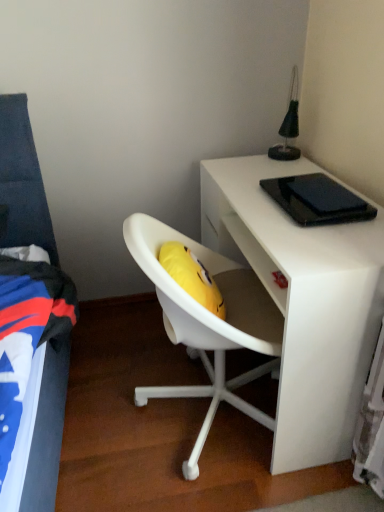
Locate an element on the screen. free space above white matte desk at upper right (from a real-world perspective) is located at coordinates (278, 194).